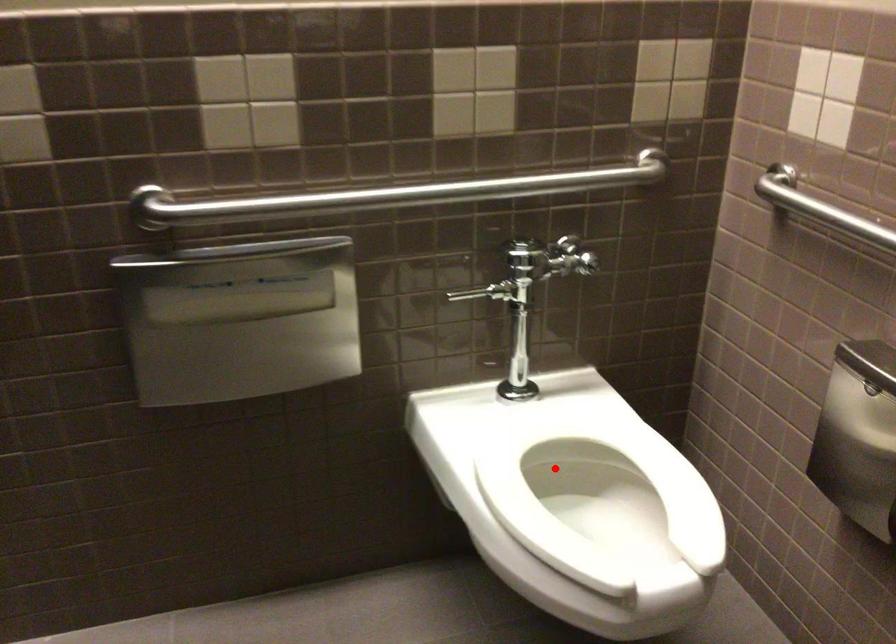
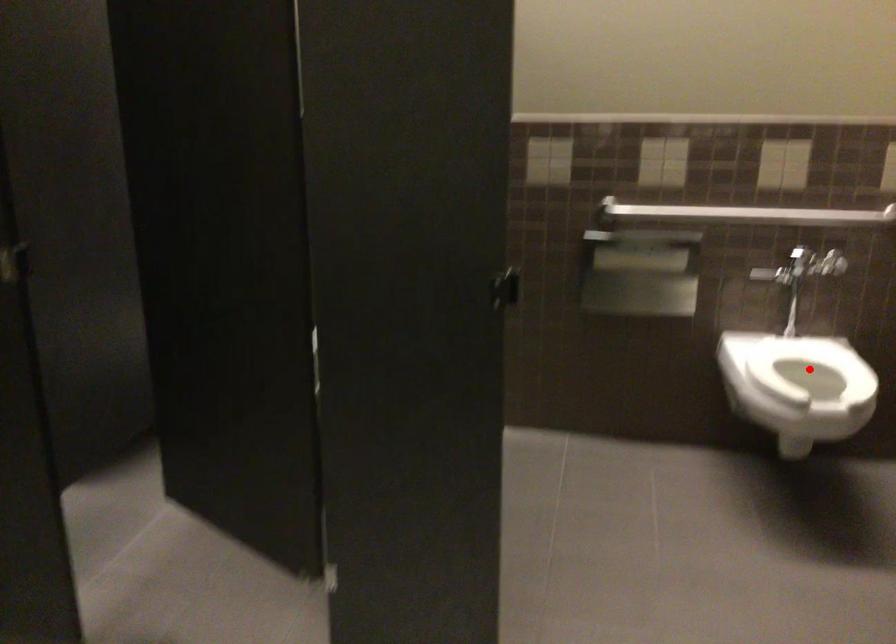
I am providing you with two images of the same scene from different viewpoints. A red point is marked on the first image and another point is marked on the second image. Does the point marked in image1 correspond to the same location as the one in image2?

Yes